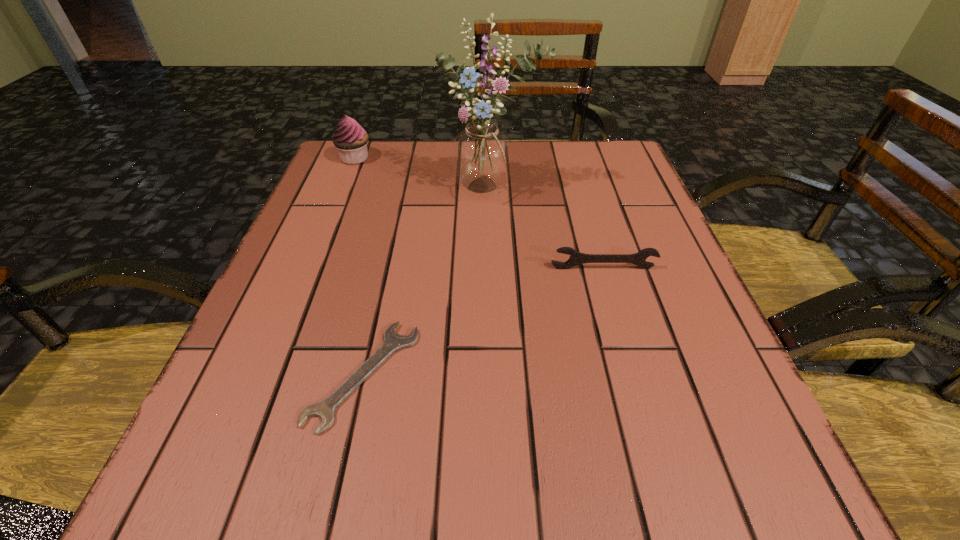
Where is `bouquet`? This screenshot has height=540, width=960. bouquet is located at coordinates (481, 154).

Identify the location of the second farthest object. This screenshot has width=960, height=540. (481, 154).

Where is `the farthest object`? the farthest object is located at coordinates (350, 139).

Find the location of a particular element. The height and width of the screenshot is (540, 960). the third shortest object is located at coordinates (350, 139).

In order to click on the third farthest object in this screenshot , I will do `click(576, 258)`.

The height and width of the screenshot is (540, 960). Find the location of `the taller wrench`. the taller wrench is located at coordinates (576, 258).

In order to click on the second object from left to right in this screenshot , I will do `click(325, 409)`.

You are a GUI agent. You are given a task and a screenshot of the screen. Output one action in this format:
    pyautogui.click(x=<x>, y=<y>)
    Task: Click on the nearest object
    
    Given the screenshot: What is the action you would take?
    pyautogui.click(x=325, y=409)

The height and width of the screenshot is (540, 960). Find the location of `vacant space located 0.290m on the front-facing side of the second farthest object`. vacant space located 0.290m on the front-facing side of the second farthest object is located at coordinates (495, 310).

Where is `free spot located on the front of the leftmost object`? The height and width of the screenshot is (540, 960). free spot located on the front of the leftmost object is located at coordinates (316, 253).